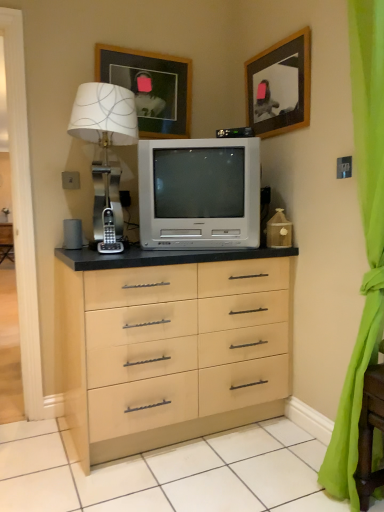
Question: Does wooden framed picture at upper center, positioned as the first picture frame in left-to-right order, come in front of wooden picture frame at upper center, acting as the 2th picture frame starting from the left?

Choices:
 (A) yes
 (B) no

Answer: (B)

Question: From a real-world perspective, does wooden framed picture at upper center, the 2th picture frame from the right, stand above wooden picture frame at upper center, which appears as the 1th picture frame when viewed from the right?

Choices:
 (A) yes
 (B) no

Answer: (A)

Question: Is wooden framed picture at upper center, the 2th picture frame from the right, placed right next to wooden picture frame at upper center, which appears as the 1th picture frame when viewed from the right?

Choices:
 (A) yes
 (B) no

Answer: (B)

Question: From a real-world perspective, is wooden framed picture at upper center, positioned as the first picture frame in left-to-right order, physically below wooden picture frame at upper center, acting as the 2th picture frame starting from the left?

Choices:
 (A) yes
 (B) no

Answer: (B)

Question: Can you confirm if wooden framed picture at upper center, positioned as the first picture frame in left-to-right order, is wider than wooden picture frame at upper center, acting as the 2th picture frame starting from the left?

Choices:
 (A) yes
 (B) no

Answer: (B)

Question: Is wooden picture frame at upper center, acting as the 2th picture frame starting from the left, wider or thinner than wooden framed picture at upper center, the 2th picture frame from the right?

Choices:
 (A) wide
 (B) thin

Answer: (A)

Question: Relative to wooden framed picture at upper center, positioned as the first picture frame in left-to-right order, is wooden picture frame at upper center, which appears as the 1th picture frame when viewed from the right, in front or behind?

Choices:
 (A) behind
 (B) front

Answer: (B)

Question: Considering the positions of wooden picture frame at upper center, which appears as the 1th picture frame when viewed from the right, and wooden framed picture at upper center, positioned as the first picture frame in left-to-right order, in the image, is wooden picture frame at upper center, which appears as the 1th picture frame when viewed from the right, taller or shorter than wooden framed picture at upper center, positioned as the first picture frame in left-to-right order,?

Choices:
 (A) tall
 (B) short

Answer: (A)

Question: Based on their positions, is wooden picture frame at upper center, acting as the 2th picture frame starting from the left, located to the left or right of wooden framed picture at upper center, positioned as the first picture frame in left-to-right order?

Choices:
 (A) left
 (B) right

Answer: (B)

Question: Is white plastic television at center in front of or behind wooden framed picture at upper center, the 2th picture frame from the right, in the image?

Choices:
 (A) front
 (B) behind

Answer: (A)

Question: From a real-world perspective, is white plastic television at center above or below wooden framed picture at upper center, the 2th picture frame from the right?

Choices:
 (A) above
 (B) below

Answer: (B)

Question: Does point (230, 175) appear closer or farther from the camera than point (153, 80)?

Choices:
 (A) farther
 (B) closer

Answer: (B)

Question: From the image's perspective, is white plastic television at center located above or below wooden framed picture at upper center, the 2th picture frame from the right?

Choices:
 (A) above
 (B) below

Answer: (B)

Question: Choose the correct answer: Is green sheer curtain at right inside metallic silver table lamp at left or outside it?

Choices:
 (A) outside
 (B) inside

Answer: (A)

Question: Considering their positions, is green sheer curtain at right located in front of or behind metallic silver table lamp at left?

Choices:
 (A) behind
 (B) front

Answer: (B)